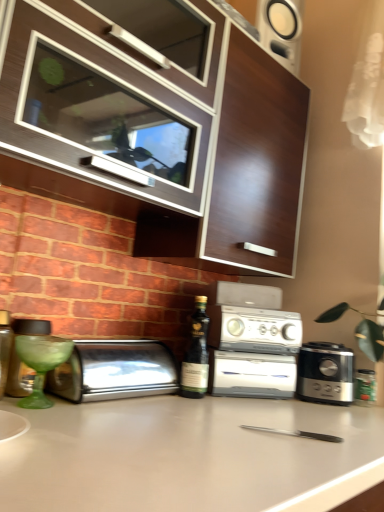
The image size is (384, 512). I want to click on matte brown bottle at left, which ranks as the 2th bottle in right-to-left order, so click(4, 348).

The image size is (384, 512). I want to click on wooden cabinet at upper center, so click(162, 127).

In order to face satin silver toaster at lower left, should I rotate leftwards or rightwards?

Rotate your view left by about 10.283°.

The image size is (384, 512). Find the location of `matte brown bottle at left, the second bottle from the back`. matte brown bottle at left, the second bottle from the back is located at coordinates (4, 348).

Does green glass jar at right, which is counted as the first bottle, starting from the right, have a lesser height compared to matte brown bottle at left, which ranks as the 2th bottle in right-to-left order?

Correct, green glass jar at right, which is counted as the first bottle, starting from the right, is not as tall as matte brown bottle at left, which ranks as the 2th bottle in right-to-left order.

Can we say green glass jar at right, which ranks as the first bottle in bottom-to-top order, lies outside matte brown bottle at left, the first bottle viewed from the top?

green glass jar at right, which ranks as the first bottle in bottom-to-top order, lies outside matte brown bottle at left, the first bottle viewed from the top,'s area.

Based on the photo, in the image, is green glass jar at right, which is counted as the first bottle, starting from the right, positioned in front of or behind matte brown bottle at left, arranged as the second bottle when ordered from the bottom?

Visually, green glass jar at right, which is counted as the first bottle, starting from the right, is located behind matte brown bottle at left, arranged as the second bottle when ordered from the bottom.

How different are the orientations of green glass jar at right, which ranks as the first bottle in bottom-to-top order, and matte brown bottle at left, the second bottle from the back, in degrees?

There is a 48.6-degree angle between the facing directions of green glass jar at right, which ranks as the first bottle in bottom-to-top order, and matte brown bottle at left, the second bottle from the back.

Is satin silver toaster at lower left wider or thinner than matte brown bottle at left, which ranks as the 2th bottle in right-to-left order?

→ Clearly, satin silver toaster at lower left has more width compared to matte brown bottle at left, which ranks as the 2th bottle in right-to-left order.

Does satin silver toaster at lower left have a smaller size compared to matte brown bottle at left, the second bottle from the back?

Actually, satin silver toaster at lower left might be larger than matte brown bottle at left, the second bottle from the back.

Can you confirm if satin silver toaster at lower left is shorter than matte brown bottle at left, marked as the first bottle in a left-to-right arrangement?

Yes.

Considering the relative positions of satin silver toaster at lower left and matte brown bottle at left, the second bottle from the back, in the image provided, is satin silver toaster at lower left in front of matte brown bottle at left, the second bottle from the back,?

No.

Would you say satin black coffee grinder at lower right is outside dark green glass bottle at center?

That's correct, satin black coffee grinder at lower right is outside of dark green glass bottle at center.

Considering the sizes of objects satin black coffee grinder at lower right and dark green glass bottle at center in the image provided, who is smaller, satin black coffee grinder at lower right or dark green glass bottle at center?

dark green glass bottle at center is smaller.

Which object is thinner, satin black coffee grinder at lower right or dark green glass bottle at center?

With smaller width is dark green glass bottle at center.

Relative to dark green glass bottle at center, is satin black coffee grinder at lower right in front or behind?

satin black coffee grinder at lower right is behind dark green glass bottle at center.

Which object is closer to the camera, white plastic toaster oven at center or dark green glass bottle at center?

dark green glass bottle at center is closer to the camera.

Considering the relative positions of white plastic toaster oven at center and dark green glass bottle at center in the image provided, is white plastic toaster oven at center to the left or to the right of dark green glass bottle at center?

white plastic toaster oven at center is to the right of dark green glass bottle at center.

Is white plastic toaster oven at center thinner than dark green glass bottle at center?

Incorrect, the width of white plastic toaster oven at center is not less than that of dark green glass bottle at center.

From a real-world perspective, is white plastic toaster oven at center physically located above or below dark green glass bottle at center?

From a real-world perspective, white plastic toaster oven at center is physically above dark green glass bottle at center.

In the image, there is a satin black coffee grinder at lower right. At what (x,y) coordinates should I click in order to perform the action: click on countertop below it (from a real-world perspective). Please return your answer as a coordinate pair (x, y). Looking at the image, I should click on (189, 456).

Is satin black coffee grinder at lower right bigger than white matte countertop at center?

No.

Is there a large distance between satin black coffee grinder at lower right and white matte countertop at center?

No, satin black coffee grinder at lower right is in close proximity to white matte countertop at center.

Is matte brown bottle at left, which ranks as the 2th bottle in right-to-left order, at the back of dark green glass bottle at center?

That's not correct — dark green glass bottle at center is not looking away from matte brown bottle at left, which ranks as the 2th bottle in right-to-left order.

Between dark green glass bottle at center and matte brown bottle at left, the first bottle positioned from the front, which one has larger width?

matte brown bottle at left, the first bottle positioned from the front, is wider.

Would you consider dark green glass bottle at center to be distant from matte brown bottle at left, which ranks as the 2th bottle in right-to-left order?

No, dark green glass bottle at center is in close proximity to matte brown bottle at left, which ranks as the 2th bottle in right-to-left order.

Which is behind, point (181, 373) or point (2, 310)?

The point (181, 373) is more distant.

Relative to dark green glass bottle at center, is wooden cabinet at upper center in front or behind?

Clearly, wooden cabinet at upper center is in front of dark green glass bottle at center.

Locate an element on the screen. This screenshot has height=512, width=384. cabinetry located in front of the dark green glass bottle at center is located at coordinates (162, 127).

Is wooden cabinet at upper center not inside dark green glass bottle at center?

That's correct, wooden cabinet at upper center is outside of dark green glass bottle at center.

At what (x,y) coordinates should I click in order to perform the action: click on bottle lying in front of the green glass jar at right, the second bottle from the left. Please return your answer as a coordinate pair (x, y). This screenshot has height=512, width=384. Looking at the image, I should click on (4, 348).

Identify the location of bottle that appears on the left of satin silver toaster at lower left. (4, 348).

From the image, which object appears to be farther from white matte countertop at center, wooden cabinet at upper center or satin black coffee grinder at lower right?

wooden cabinet at upper center is positioned further to the anchor white matte countertop at center.

Looking at the image, which one is located closer to dark green glass bottle at center, satin silver toaster at lower left or matte brown bottle at left, the first bottle viewed from the top?

satin silver toaster at lower left is positioned closer to the anchor dark green glass bottle at center.

Considering their positions, is satin black coffee grinder at lower right positioned closer to white plastic toaster oven at center than matte brown bottle at left, which ranks as the 2th bottle in right-to-left order?

Based on the image, satin black coffee grinder at lower right appears to be nearer to white plastic toaster oven at center.

From the image, which object appears to be nearer to wooden cabinet at upper center, green glass jar at right, which is counted as the first bottle, starting from the right, or dark green glass bottle at center?

dark green glass bottle at center.

From the image, which object appears to be farther from dark green glass bottle at center, wooden cabinet at upper center or matte brown bottle at left, the second bottle from the back?

wooden cabinet at upper center is further to dark green glass bottle at center.

From the image, which object appears to be nearer to white matte countertop at center, dark green glass bottle at center or matte brown bottle at left, marked as the first bottle in a left-to-right arrangement?

dark green glass bottle at center is closer to white matte countertop at center.

Looking at the image, which one is located closer to satin silver toaster at lower left, satin black coffee grinder at lower right or matte brown bottle at left, which ranks as the 2th bottle in right-to-left order?

Based on the image, matte brown bottle at left, which ranks as the 2th bottle in right-to-left order, appears to be nearer to satin silver toaster at lower left.

Looking at the image, which one is located closer to wooden cabinet at upper center, dark green glass bottle at center or white matte countertop at center?

dark green glass bottle at center lies closer to wooden cabinet at upper center than the other object.

This screenshot has width=384, height=512. Find the location of `home appliance between matte brown bottle at left, which ranks as the 2th bottle in right-to-left order, and satin black coffee grinder at lower right from left to right`. home appliance between matte brown bottle at left, which ranks as the 2th bottle in right-to-left order, and satin black coffee grinder at lower right from left to right is located at coordinates (252, 342).

At what (x,y) coordinates should I click in order to perform the action: click on toaster between matte brown bottle at left, the first bottle positioned from the front, and white plastic toaster oven at center, in the horizontal direction. Please return your answer as a coordinate pair (x, y). The image size is (384, 512). Looking at the image, I should click on (114, 371).

At what (x,y) coordinates should I click in order to perform the action: click on toaster that lies between wooden cabinet at upper center and green glass jar at right, which ranks as the first bottle in bottom-to-top order, from top to bottom. Please return your answer as a coordinate pair (x, y). Looking at the image, I should click on (114, 371).

Find the location of `wine bottle between satin silver toaster at lower left and satin black coffee grinder at lower right`. wine bottle between satin silver toaster at lower left and satin black coffee grinder at lower right is located at coordinates (196, 354).